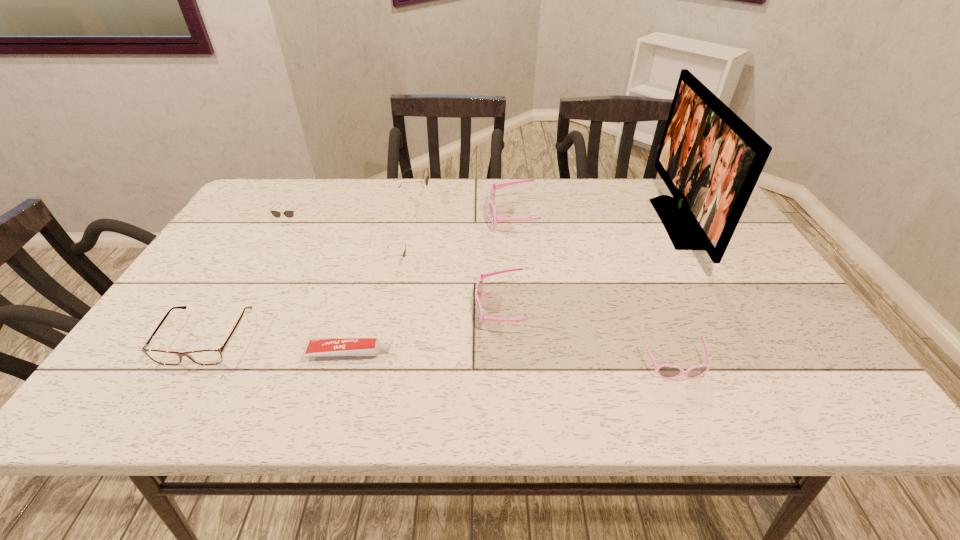
The width and height of the screenshot is (960, 540). Find the location of `free space located 0.260m on the front-facing side of the farthest pink sunglasses`. free space located 0.260m on the front-facing side of the farthest pink sunglasses is located at coordinates (401, 218).

The width and height of the screenshot is (960, 540). I want to click on free spot located on the front-facing side of the farthest pink sunglasses, so click(x=465, y=218).

The image size is (960, 540). Find the location of `free location located 0.390m in front of the lenses of the second farthest black sunglasses`. free location located 0.390m in front of the lenses of the second farthest black sunglasses is located at coordinates (231, 335).

Find the location of `free space located on the front-facing side of the second nearest pink sunglasses`. free space located on the front-facing side of the second nearest pink sunglasses is located at coordinates (437, 309).

You are a GUI agent. You are given a task and a screenshot of the screen. Output one action in this format:
    pyautogui.click(x=<x>, y=<y>)
    Task: Click on the vacant region located on the front-facing side of the second nearest pink sunglasses
    Image resolution: width=960 pixels, height=540 pixels.
    Given the screenshot: What is the action you would take?
    pyautogui.click(x=420, y=309)

Where is `vacant space located 0.220m on the front-facing side of the second nearest pink sunglasses`? This screenshot has height=540, width=960. vacant space located 0.220m on the front-facing side of the second nearest pink sunglasses is located at coordinates (382, 309).

You are a GUI agent. You are given a task and a screenshot of the screen. Output one action in this format:
    pyautogui.click(x=<x>, y=<y>)
    Task: Click on the vacant point located in front of the lenses of the smallest black sunglasses
    The height and width of the screenshot is (540, 960).
    Given the screenshot: What is the action you would take?
    pyautogui.click(x=515, y=263)

I want to click on blank space located on the lenses of the spectacles, so click(x=175, y=391).

What are the coordinates of `free region located 0.060m on the front-facing side of the eighth object from left to right` in the screenshot? It's located at (691, 409).

I want to click on vacant space located 0.370m at the nozzle of the shortest object, so click(x=564, y=353).